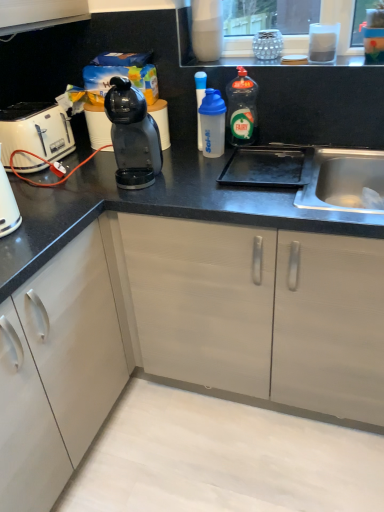
Question: Considering the relative sizes of white plastic shaker at center, which is counted as the second bottle, starting from the left, and transparent plastic bottle at center, which is the third bottle in left-to-right order, in the image provided, is white plastic shaker at center, which is counted as the second bottle, starting from the left, thinner than transparent plastic bottle at center, which is the third bottle in left-to-right order,?

Choices:
 (A) yes
 (B) no

Answer: (B)

Question: Is white plastic shaker at center, which is counted as the second bottle, starting from the left, at the left side of transparent plastic bottle at center, which is the third bottle in left-to-right order?

Choices:
 (A) no
 (B) yes

Answer: (B)

Question: From a real-world perspective, is white plastic shaker at center, which is counted as the second bottle, starting from the left, over transparent plastic bottle at center, which is the third bottle in left-to-right order?

Choices:
 (A) no
 (B) yes

Answer: (A)

Question: Is transparent plastic bottle at center, the first bottle from the right, at the back of white plastic shaker at center, the 2th bottle viewed from the right?

Choices:
 (A) yes
 (B) no

Answer: (B)

Question: Is white plastic shaker at center, the 2th bottle viewed from the right, located outside transparent plastic bottle at center, which is the third bottle in left-to-right order?

Choices:
 (A) no
 (B) yes

Answer: (B)

Question: Looking at their shapes, would you say transparent plastic bottle at center, the first bottle from the right, is wider or thinner than white plastic shaker at center, which is counted as the second bottle, starting from the left?

Choices:
 (A) wide
 (B) thin

Answer: (B)

Question: Considering the positions of transparent plastic bottle at center, the first bottle from the right, and white plastic shaker at center, which is counted as the second bottle, starting from the left, in the image, is transparent plastic bottle at center, the first bottle from the right, bigger or smaller than white plastic shaker at center, which is counted as the second bottle, starting from the left,?

Choices:
 (A) big
 (B) small

Answer: (A)

Question: Is transparent plastic bottle at center, the first bottle from the right, situated inside white plastic shaker at center, which is counted as the second bottle, starting from the left, or outside?

Choices:
 (A) outside
 (B) inside

Answer: (A)

Question: Considering the positions of transparent plastic bottle at center, which is the third bottle in left-to-right order, and white plastic shaker at center, the 2th bottle viewed from the right, in the image, is transparent plastic bottle at center, which is the third bottle in left-to-right order, taller or shorter than white plastic shaker at center, the 2th bottle viewed from the right,?

Choices:
 (A) short
 (B) tall

Answer: (B)

Question: In terms of width, does white plastic shaker at center, which is counted as the second bottle, starting from the left, look wider or thinner when compared to black plastic coffee machine at center?

Choices:
 (A) thin
 (B) wide

Answer: (A)

Question: From the image's perspective, is white plastic shaker at center, which is counted as the second bottle, starting from the left, positioned above or below black plastic coffee machine at center?

Choices:
 (A) above
 (B) below

Answer: (A)

Question: Which is correct: white plastic shaker at center, the 2th bottle viewed from the right, is inside black plastic coffee machine at center, or outside of it?

Choices:
 (A) outside
 (B) inside

Answer: (A)

Question: Relative to black plastic coffee machine at center, is white plastic shaker at center, which is counted as the second bottle, starting from the left, in front or behind?

Choices:
 (A) behind
 (B) front

Answer: (A)

Question: From a real-world perspective, is white plastic toaster at left physically located above or below transparent plastic shaker at center, marked as the 3th bottle in a right-to-left arrangement?

Choices:
 (A) above
 (B) below

Answer: (B)

Question: From their relative heights in the image, would you say white plastic toaster at left is taller or shorter than transparent plastic shaker at center, marked as the 3th bottle in a right-to-left arrangement?

Choices:
 (A) short
 (B) tall

Answer: (A)